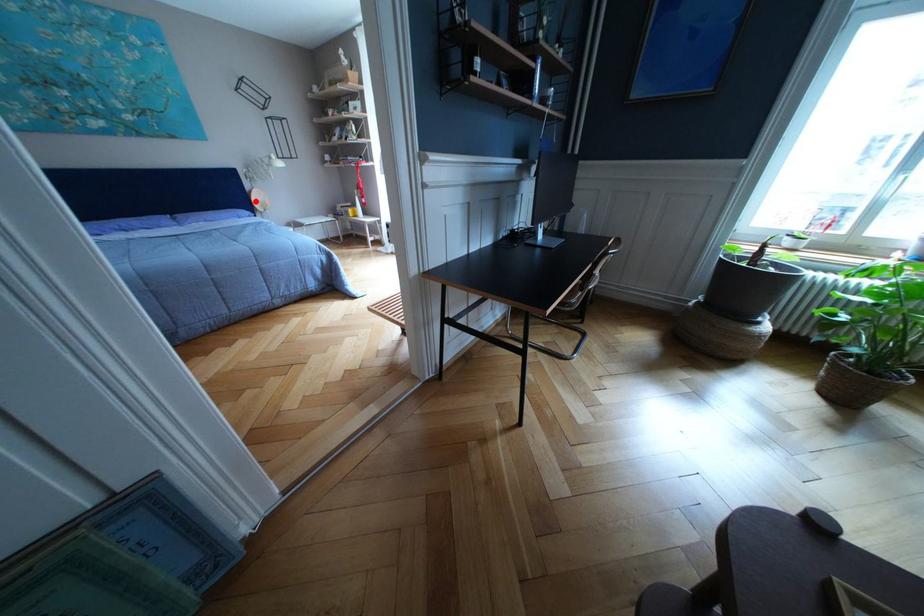
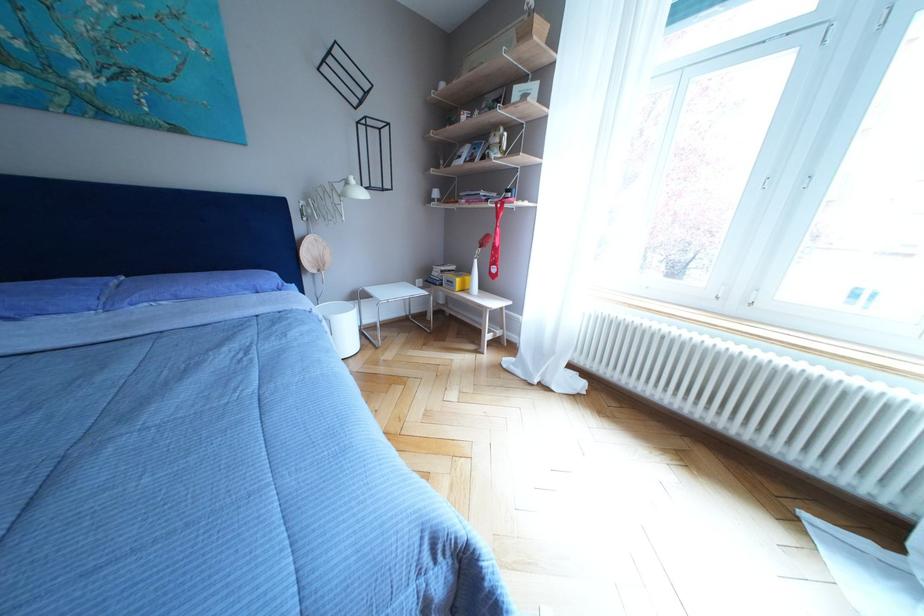
Question: I am providing you with two images of the same scene from different viewpoints. Given a red point in image1, look at the same physical point in image2. Is it:

Choices:
 (A) Closer to the viewpoint
 (B) Farther from the viewpoint

Answer: (B)